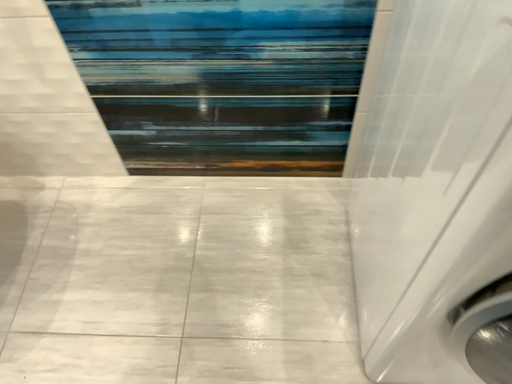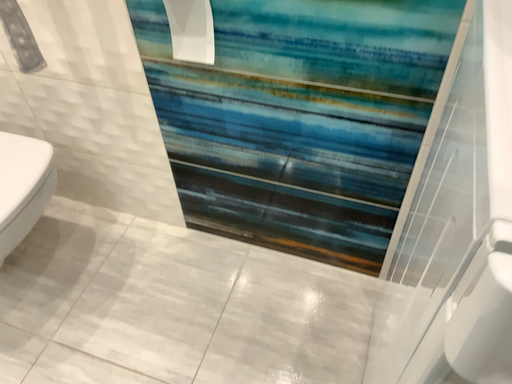
Question: Which way did the camera rotate in the video?

Choices:
 (A) rotated right
 (B) rotated left

Answer: (B)